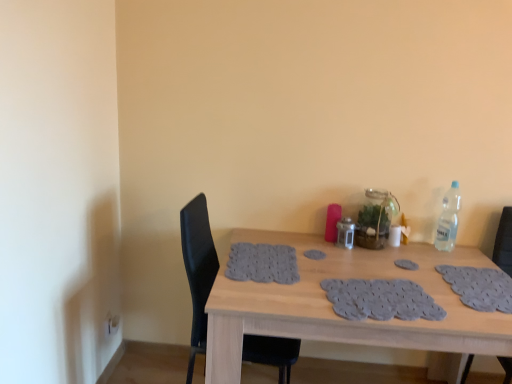
The height and width of the screenshot is (384, 512). What are the coordinates of `free space in front of gray fabric footprint at center, placed as the 1th footprint when sorted from left to right` in the screenshot? It's located at (331, 271).